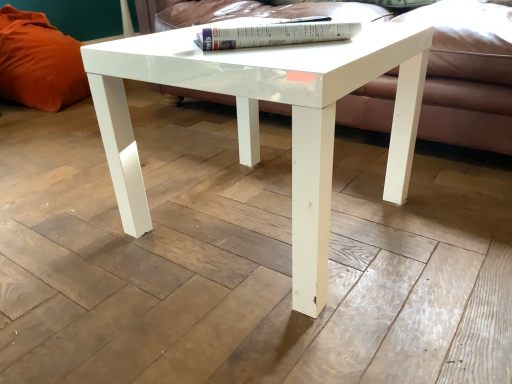
The image size is (512, 384). What do you see at coordinates (39, 62) in the screenshot? I see `orange fabric pillow at left` at bounding box center [39, 62].

The width and height of the screenshot is (512, 384). What do you see at coordinates (276, 34) in the screenshot? I see `white glossy book at upper center` at bounding box center [276, 34].

Measure the distance between point (281, 44) and camera.

A distance of 31.18 inches exists between point (281, 44) and camera.

Where is `orange fabric pillow at left`? Image resolution: width=512 pixels, height=384 pixels. orange fabric pillow at left is located at coordinates (39, 62).

Which of these two, orange fabric pillow at left or white glossy coffee table at center, stands shorter?

white glossy coffee table at center.

Considering the points (10, 26) and (310, 300), which point is in front, point (10, 26) or point (310, 300)?

The point (310, 300) is closer.

There is a white glossy coffee table at center. Where is `pillow above it (from a real-world perspective)`? The width and height of the screenshot is (512, 384). pillow above it (from a real-world perspective) is located at coordinates (39, 62).

Considering the sizes of objects orange fabric pillow at left and white glossy coffee table at center in the image provided, who is bigger, orange fabric pillow at left or white glossy coffee table at center?

orange fabric pillow at left.

Are white glossy coffee table at center and orange fabric pillow at left located far from each other?

Yes, white glossy coffee table at center and orange fabric pillow at left are quite far apart.

Is white glossy coffee table at center positioned beyond the bounds of orange fabric pillow at left?

Yes, white glossy coffee table at center is outside of orange fabric pillow at left.

From the image's perspective, would you say white glossy coffee table at center is shown under orange fabric pillow at left?

Correct, white glossy coffee table at center appears lower than orange fabric pillow at left in the image.

Is white glossy book at upper center to the left of matte white couch at center from the viewer's perspective?

Correct, you'll find white glossy book at upper center to the left of matte white couch at center.

Between white glossy book at upper center and matte white couch at center, which one has less height?

With less height is white glossy book at upper center.

From the image's perspective, between white glossy book at upper center and matte white couch at center, which one is located above?

From the image's view, matte white couch at center is above.

You are a GUI agent. You are given a task and a screenshot of the screen. Output one action in this format:
    pyautogui.click(x=<x>, y=<y>)
    Task: Click on the book positioned vertically above the matte white couch at center (from a real-world perspective)
    The image size is (512, 384).
    Given the screenshot: What is the action you would take?
    pyautogui.click(x=276, y=34)

Who is shorter, white glossy book at upper center or white glossy coffee table at center?

Standing shorter between the two is white glossy book at upper center.

Is point (221, 31) positioned before point (301, 240)?

No, it is not.

Who is more distant, white glossy book at upper center or white glossy coffee table at center?

white glossy book at upper center is more distant.

Is white glossy book at upper center facing away from white glossy coffee table at center?

No, white glossy coffee table at center is not at the back of white glossy book at upper center.

Considering the positions of objects matte white couch at center and orange fabric pillow at left in the image provided, who is in front, matte white couch at center or orange fabric pillow at left?

matte white couch at center is more forward.

Is matte white couch at center not near orange fabric pillow at left?

Yes, matte white couch at center and orange fabric pillow at left are located far from each other.

Visually, is matte white couch at center positioned to the left or to the right of orange fabric pillow at left?

Clearly, matte white couch at center is on the right of orange fabric pillow at left in the image.

At what (x,y) coordinates should I click in order to perform the action: click on pillow that appears behind the matte white couch at center. Please return your answer as a coordinate pair (x, y). The height and width of the screenshot is (384, 512). Looking at the image, I should click on (39, 62).

From the picture: From the image's perspective, who appears lower, white glossy coffee table at center or white glossy book at upper center?

white glossy coffee table at center is shown below in the image.

Which is more to the left, white glossy coffee table at center or white glossy book at upper center?

white glossy coffee table at center.

Does white glossy coffee table at center come behind white glossy book at upper center?

That is False.

Does point (52, 56) come behind point (298, 38)?

Yes, point (52, 56) is farther from viewer.

Does orange fabric pillow at left have a smaller size compared to white glossy book at upper center?

No.

Can you tell me how much orange fabric pillow at left and white glossy book at upper center differ in facing direction?

48.5 degrees.

Visually, is orange fabric pillow at left positioned to the left or to the right of white glossy book at upper center?

Clearly, orange fabric pillow at left is on the left of white glossy book at upper center in the image.

Where is `pillow above the white glossy coffee table at center (from the image's perspective)`? The height and width of the screenshot is (384, 512). pillow above the white glossy coffee table at center (from the image's perspective) is located at coordinates (39, 62).

This screenshot has width=512, height=384. In the image, there is a orange fabric pillow at left. Find the location of `coffee table below it (from the image's perspective)`. coffee table below it (from the image's perspective) is located at coordinates (258, 118).

Based on their spatial positions, is orange fabric pillow at left or matte white couch at center further from white glossy coffee table at center?

The object further to white glossy coffee table at center is orange fabric pillow at left.

Estimate the real-world distances between objects in this image. Which object is further from orange fabric pillow at left, white glossy coffee table at center or matte white couch at center?

matte white couch at center lies further to orange fabric pillow at left than the other object.

When comparing their distances from orange fabric pillow at left, does white glossy coffee table at center or white glossy book at upper center seem closer?

white glossy coffee table at center lies closer to orange fabric pillow at left than the other object.

Based on their spatial positions, is matte white couch at center or white glossy coffee table at center further from orange fabric pillow at left?

matte white couch at center lies further to orange fabric pillow at left than the other object.

Based on their spatial positions, is orange fabric pillow at left or white glossy coffee table at center closer to white glossy book at upper center?

Among the two, white glossy coffee table at center is located nearer to white glossy book at upper center.

Considering their positions, is matte white couch at center positioned closer to white glossy coffee table at center than white glossy book at upper center?

Among the two, white glossy book at upper center is located nearer to white glossy coffee table at center.

Considering their positions, is white glossy book at upper center positioned closer to orange fabric pillow at left than white glossy coffee table at center?

white glossy coffee table at center is positioned closer to the anchor orange fabric pillow at left.

When comparing their distances from matte white couch at center, does white glossy coffee table at center or orange fabric pillow at left seem further?

orange fabric pillow at left.

The image size is (512, 384). I want to click on coffee table situated between orange fabric pillow at left and white glossy book at upper center from left to right, so click(x=258, y=118).

Image resolution: width=512 pixels, height=384 pixels. What are the coordinates of `book between orange fabric pillow at left and matte white couch at center in the horizontal direction` in the screenshot? It's located at (276, 34).

Where is `book between matte white couch at center and white glossy coffee table at center in the up-down direction`? book between matte white couch at center and white glossy coffee table at center in the up-down direction is located at coordinates (276, 34).

At what (x,y) coordinates should I click in order to perform the action: click on coffee table located between orange fabric pillow at left and matte white couch at center in the left-right direction. Please return your answer as a coordinate pair (x, y). This screenshot has height=384, width=512. Looking at the image, I should click on (258, 118).